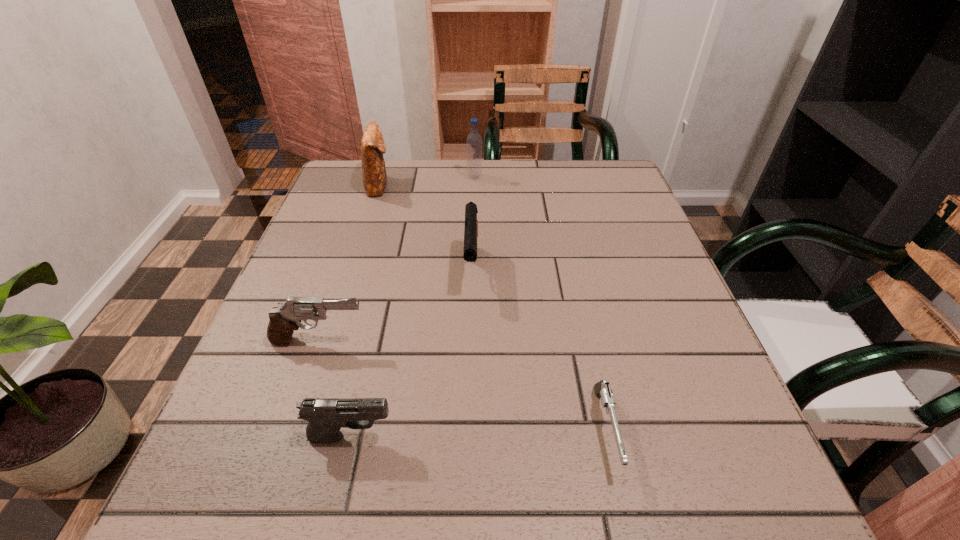
This screenshot has height=540, width=960. Find the location of `free space in the image that satisfies the following two spatial constraints: 1. at the barrel of the fourth nearest object; 2. at the barrel of the fifth tallest object`. free space in the image that satisfies the following two spatial constraints: 1. at the barrel of the fourth nearest object; 2. at the barrel of the fifth tallest object is located at coordinates (468, 436).

At what (x,y) coordinates should I click in order to perform the action: click on vacant point that satisfies the following two spatial constraints: 1. on the front-facing side of the shortest object; 2. at the barrel of the second shortest pistol. Please return your answer as a coordinate pair (x, y). This screenshot has width=960, height=540. Looking at the image, I should click on (607, 436).